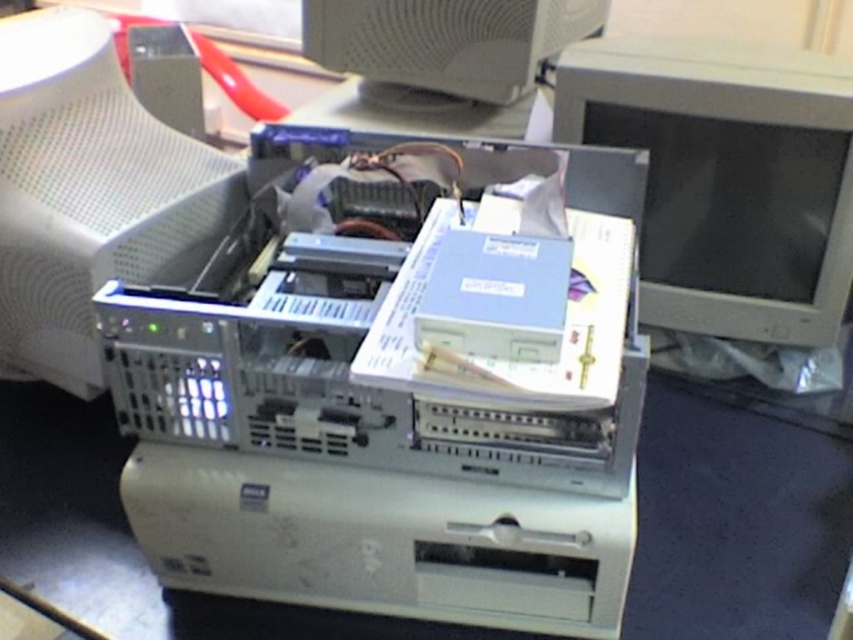
Question: From the image, what is the correct spatial relationship of matte gray monitor at right in relation to white plastic monitor at upper center?

Choices:
 (A) left
 (B) right

Answer: (B)

Question: Which object appears farthest from the camera in this image?

Choices:
 (A) white plastic computer monitor at upper left
 (B) white plastic monitor at upper center

Answer: (B)

Question: Which of the following is the closest to the observer?

Choices:
 (A) (523, 60)
 (B) (91, 193)

Answer: (B)

Question: Which point is farther to the camera?

Choices:
 (A) (518, 44)
 (B) (91, 97)
 (C) (722, 157)

Answer: (A)

Question: Considering the relative positions of matte gray monitor at right and white plastic monitor at upper center in the image provided, where is matte gray monitor at right located with respect to white plastic monitor at upper center?

Choices:
 (A) above
 (B) below

Answer: (B)

Question: Does matte gray monitor at right appear over white plastic computer monitor at upper left?

Choices:
 (A) no
 (B) yes

Answer: (B)